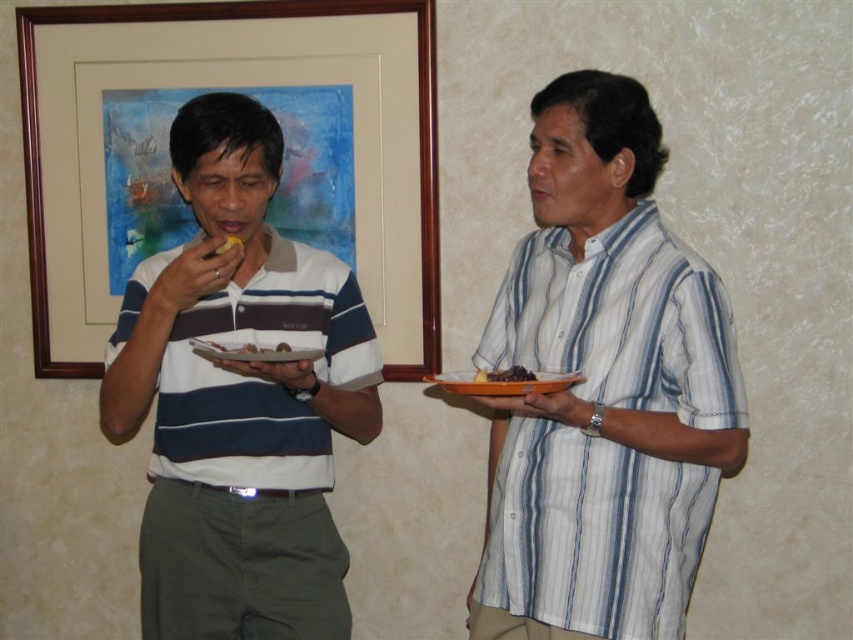
You are at a social gathering and see two types of food on plates. The dark brown matte food at right and the yellow matte food at center. Which food is positioned lower in the image?

The dark brown matte food at right is below the yellow matte food at center, so it is positioned lower in the image.

What is the object located at the coordinates point (x=503, y=384) in the image?

The point (x=503, y=384) marks the orange matte platter at right.